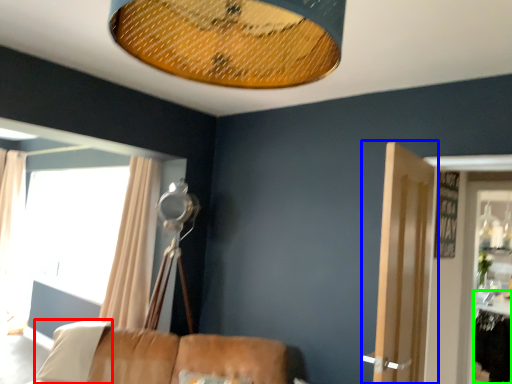
Question: Estimate the real-world distances between objects in this image. Which object is farther from pillow (highlighted by a red box), door (highlighted by a blue box) or table (highlighted by a green box)?

Choices:
 (A) door
 (B) table

Answer: (B)